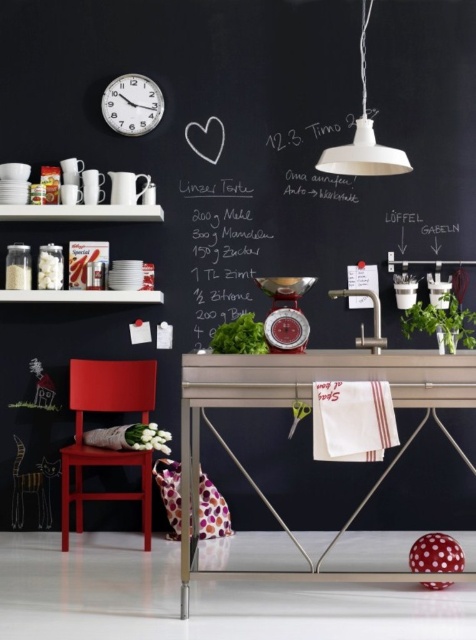
From the picture: You are planning to place a rectangular cutting board on the metallic silver table at center. Considering the green leafy vegetable at center is already on the table, will the cutting board fit horizontally if its length matches the table width?

The metallic silver table at center is wider than the green leafy vegetable at center. Since the cutting board length matches the table width, it should fit horizontally as the table is wider than the vegetable, but ensure there is enough space around the vegetable.